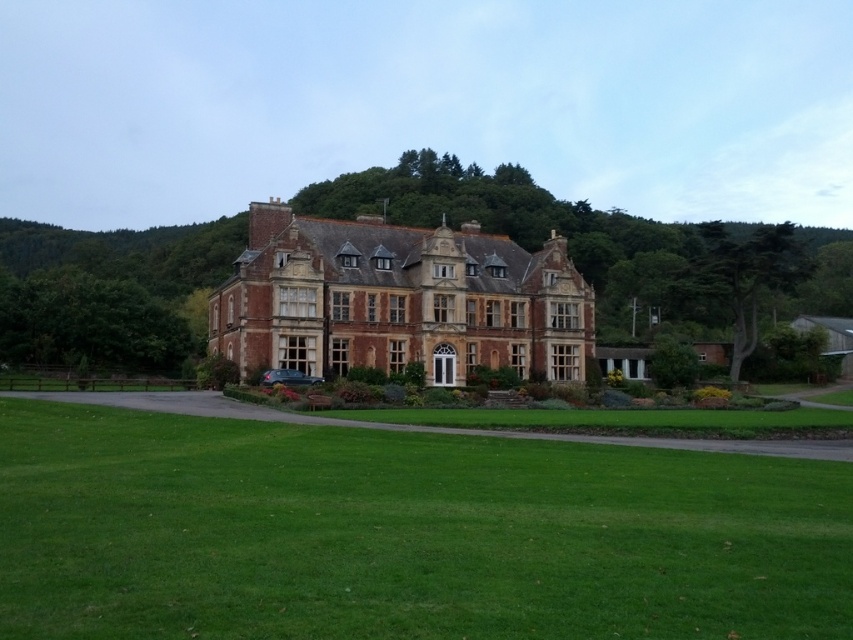
You are standing on the green grass at center and want to reach the brown brick mansion at center. Which direction should you move to get closer to the mansion?

You should move upward because the green grass at center is below the brown brick mansion at center, so moving upward will bring you closer to the mansion.

You are a gardener who needs to mow the lawn. You see the green grass at center and the brown brick mansion at center. Which object is shorter and requires mowing?

The green grass at center is shorter than the brown brick mansion at center, so you should mow the green grass at center.

You are planning to host a small outdoor event on the lawn of the brown brick mansion at center. Considering the space available, can the green grass at center accommodate a 10x10 meter tent?

The green grass at center might be wider than brown brick mansion at center, so it is possible that there is sufficient space to accommodate a 10x10 meter tent on the lawn.